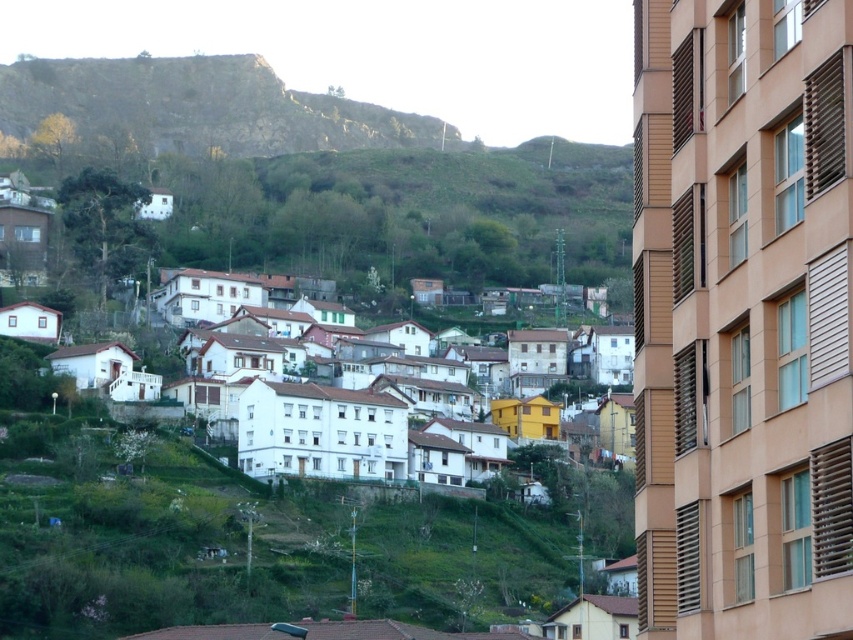
Is point (20, 99) farther from camera compared to point (277, 426)?

Yes.

Between rustic stone hillside at upper left and white matte houses at center, which one appears on the right side from the viewer's perspective?

white matte houses at center

Identify the location of rustic stone hillside at upper left. The height and width of the screenshot is (640, 853). (204, 106).